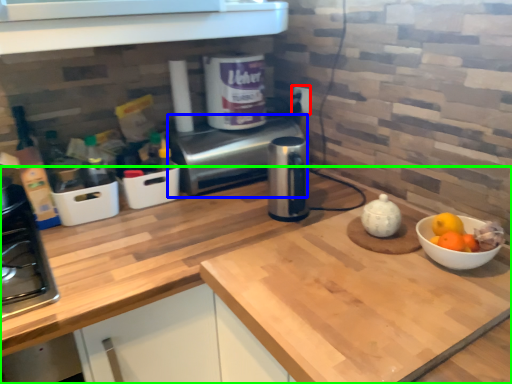
Question: Considering the real-world distances, which object is closest to electric outlet (highlighted by a red box)? oven (highlighted by a blue box) or countertop (highlighted by a green box).

Choices:
 (A) oven
 (B) countertop

Answer: (A)